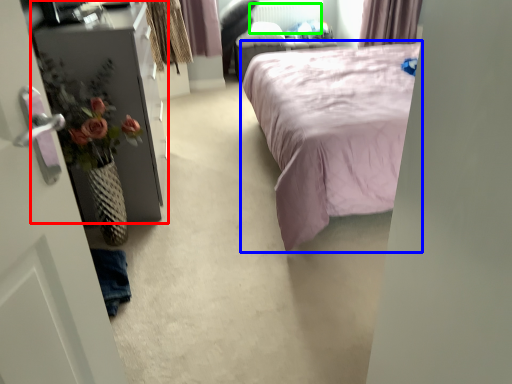
Question: Which object is the closest to the furniture (highlighted by a red box)? Choose among these: bed (highlighted by a blue box) or radiator (highlighted by a green box).

Choices:
 (A) bed
 (B) radiator

Answer: (A)